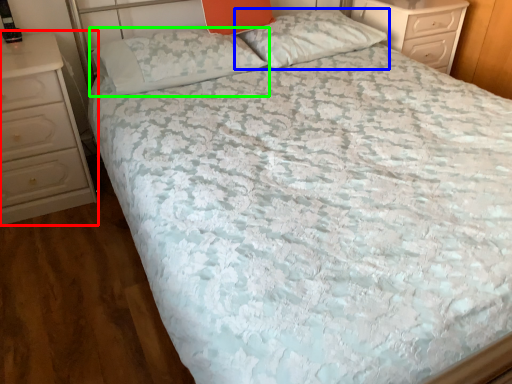
Question: Considering the real-world distances, which object is farthest from chest of drawers (highlighted by a red box)? pillow (highlighted by a blue box) or pillow (highlighted by a green box)?

Choices:
 (A) pillow
 (B) pillow

Answer: (A)